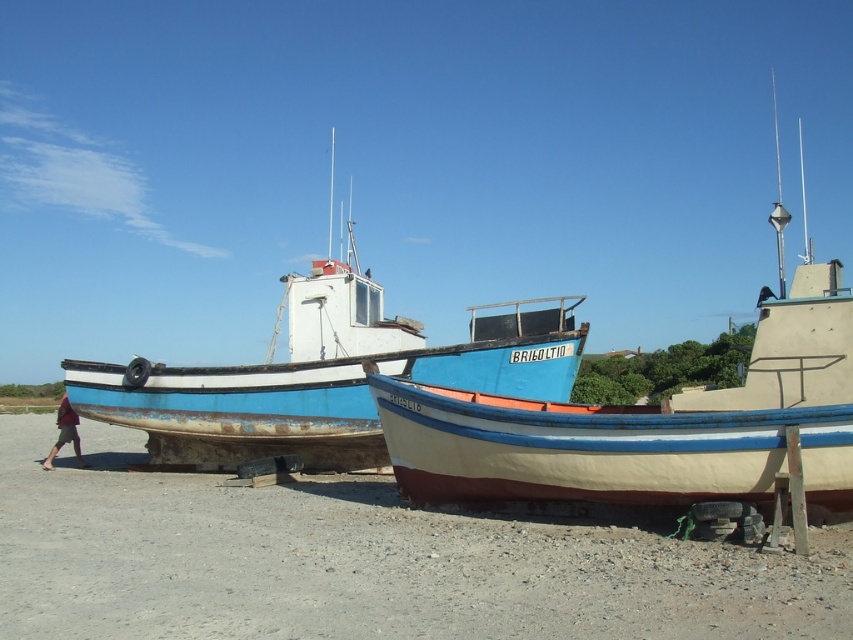
Can you confirm if blue wooden boat at center is thinner than red cotton shirt at lower left?

Incorrect, blue wooden boat at center's width is not less than red cotton shirt at lower left's.

Based on the photo, who is positioned more to the right, blue wooden boat at center or red cotton shirt at lower left?

Positioned to the right is blue wooden boat at center.

Locate an element on the screen. The width and height of the screenshot is (853, 640). blue wooden boat at center is located at coordinates (323, 376).

Describe the element at coordinates (363, 563) in the screenshot. This screenshot has width=853, height=640. I see `rusty metal boat at lower center` at that location.

Which is in front, point (276, 552) or point (845, 336)?

Positioned in front is point (276, 552).

Does point (19, 522) come closer to viewer compared to point (550, 451)?

No.

This screenshot has width=853, height=640. What are the coordinates of `rusty metal boat at lower center` in the screenshot? It's located at (363, 563).

Between point (788, 388) and point (294, 356), which one is positioned behind?

The point (294, 356) is behind.

Which is in front, point (659, 465) or point (158, 428)?

Point (659, 465) is more forward.

Find the location of a particular element. The width and height of the screenshot is (853, 640). blue painted wood boat at center is located at coordinates (654, 422).